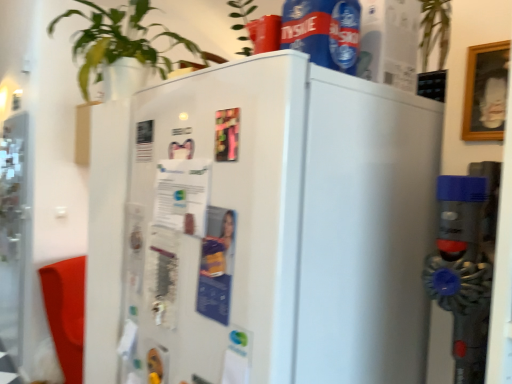
What do you see at coordinates (323, 31) in the screenshot?
I see `blue plastic bottle at upper center` at bounding box center [323, 31].

Locate an element on the screen. The width and height of the screenshot is (512, 384). blue plastic bottle at upper center is located at coordinates (323, 31).

Where is `blue plastic bottle at upper center`? The image size is (512, 384). blue plastic bottle at upper center is located at coordinates 323,31.

Is there a large distance between white glossy refrigerator at center and transparent glass screen door at left?

Yes, white glossy refrigerator at center and transparent glass screen door at left are quite far apart.

Who is smaller, white glossy refrigerator at center or transparent glass screen door at left?

With smaller size is transparent glass screen door at left.

Does white glossy refrigerator at center have a lesser height compared to transparent glass screen door at left?

Correct, white glossy refrigerator at center is not as tall as transparent glass screen door at left.

Which is closer, (317, 366) or (19, 317)?

Point (317, 366) appears to be closer to the viewer than point (19, 317).

Could you tell me if transparent glass screen door at left is turned towards white glossy refrigerator at center?

No, transparent glass screen door at left is not facing towards white glossy refrigerator at center.

In the image, is transparent glass screen door at left on the left side or the right side of white glossy refrigerator at center?

Based on their positions, transparent glass screen door at left is located to the left of white glossy refrigerator at center.

Is transparent glass screen door at left bigger than white glossy refrigerator at center?

Actually, transparent glass screen door at left might be smaller than white glossy refrigerator at center.

Is point (9, 138) behind point (92, 292)?

Yes, it is behind point (92, 292).

You are a GUI agent. You are given a task and a screenshot of the screen. Output one action in this format:
    pyautogui.click(x=<x>, y=<y>)
    Task: Click on the screen door to the left of blue plastic bottle at upper center
    The width and height of the screenshot is (512, 384).
    Given the screenshot: What is the action you would take?
    pyautogui.click(x=13, y=231)

Considering the sizes of transparent glass screen door at left and blue plastic bottle at upper center in the image, is transparent glass screen door at left taller or shorter than blue plastic bottle at upper center?

transparent glass screen door at left is taller than blue plastic bottle at upper center.

Would you say transparent glass screen door at left is to the left or to the right of blue plastic bottle at upper center in the picture?

transparent glass screen door at left is to the left of blue plastic bottle at upper center.

Is green leafy plant at upper left turned away from blue plastic bottle at upper center?

No, blue plastic bottle at upper center is not at the back of green leafy plant at upper left.

From the image's perspective, between green leafy plant at upper left and blue plastic bottle at upper center, which one is located above?

green leafy plant at upper left.

Can you tell me how much green leafy plant at upper left and blue plastic bottle at upper center differ in facing direction?

The facing directions of green leafy plant at upper left and blue plastic bottle at upper center are 180 degrees apart.

Considering the sizes of objects green leafy plant at upper left and white glossy refrigerator at center in the image provided, who is wider, green leafy plant at upper left or white glossy refrigerator at center?

Wider between the two is white glossy refrigerator at center.

Considering the sizes of objects green leafy plant at upper left and white glossy refrigerator at center in the image provided, who is bigger, green leafy plant at upper left or white glossy refrigerator at center?

white glossy refrigerator at center.

Is the position of green leafy plant at upper left less distant than that of white glossy refrigerator at center?

No, green leafy plant at upper left is behind white glossy refrigerator at center.

Locate an element on the screen. This screenshot has height=384, width=512. houseplant behind the white glossy refrigerator at center is located at coordinates (119, 40).

Can you confirm if white glossy refrigerator at center is taller than green leafy plant at upper left?

Correct, white glossy refrigerator at center is much taller as green leafy plant at upper left.

Considering the sizes of white glossy refrigerator at center and green leafy plant at upper left in the image, is white glossy refrigerator at center bigger or smaller than green leafy plant at upper left?

In the image, white glossy refrigerator at center appears to be larger than green leafy plant at upper left.

From the image's perspective, is white glossy refrigerator at center positioned above or below green leafy plant at upper left?

Clearly, from the image's perspective, white glossy refrigerator at center is below green leafy plant at upper left.

You are a GUI agent. You are given a task and a screenshot of the screen. Output one action in this format:
    pyautogui.click(x=<x>, y=<y>)
    Task: Click on the houseplant lying above the white glossy refrigerator at center (from the image's perspective)
    The width and height of the screenshot is (512, 384).
    Given the screenshot: What is the action you would take?
    pyautogui.click(x=119, y=40)

In terms of height, does blue plastic bottle at upper center look taller or shorter compared to green leafy plant at upper left?

Considering their sizes, blue plastic bottle at upper center has less height than green leafy plant at upper left.

Considering their positions, is blue plastic bottle at upper center located in front of or behind green leafy plant at upper left?

In the image, blue plastic bottle at upper center appears in front of green leafy plant at upper left.

I want to click on screen door beneath the white glossy refrigerator at center (from a real-world perspective), so click(13, 231).

You are a GUI agent. You are given a task and a screenshot of the screen. Output one action in this format:
    pyautogui.click(x=<x>, y=<y>)
    Task: Click on the refrigerator that appears above the transparent glass screen door at left (from the image's perspective)
    This screenshot has width=512, height=384.
    Given the screenshot: What is the action you would take?
    pyautogui.click(x=271, y=230)

Considering their positions, is transparent glass screen door at left positioned further to green leafy plant at upper left than white glossy refrigerator at center?

Among the two, transparent glass screen door at left is located further to green leafy plant at upper left.

Looking at the image, which one is located closer to blue plastic bottle at upper center, green leafy plant at upper left or white glossy refrigerator at center?

Among the two, white glossy refrigerator at center is located nearer to blue plastic bottle at upper center.

Estimate the real-world distances between objects in this image. Which object is closer to transparent glass screen door at left, white glossy refrigerator at center or green leafy plant at upper left?

green leafy plant at upper left.

Looking at the image, which one is located closer to green leafy plant at upper left, blue plastic bottle at upper center or transparent glass screen door at left?

blue plastic bottle at upper center is closer to green leafy plant at upper left.

When comparing their distances from green leafy plant at upper left, does transparent glass screen door at left or blue plastic bottle at upper center seem closer?

The object closer to green leafy plant at upper left is blue plastic bottle at upper center.

Estimate the real-world distances between objects in this image. Which object is further from white glossy refrigerator at center, blue plastic bottle at upper center or transparent glass screen door at left?

transparent glass screen door at left lies further to white glossy refrigerator at center than the other object.

Looking at the image, which one is located further to transparent glass screen door at left, green leafy plant at upper left or blue plastic bottle at upper center?

Based on the image, blue plastic bottle at upper center appears to be further to transparent glass screen door at left.

Estimate the real-world distances between objects in this image. Which object is closer to green leafy plant at upper left, white glossy refrigerator at center or blue plastic bottle at upper center?

white glossy refrigerator at center.

Where is `beverage positioned between white glossy refrigerator at center and transparent glass screen door at left from near to far`? beverage positioned between white glossy refrigerator at center and transparent glass screen door at left from near to far is located at coordinates (323, 31).

Where is `houseplant positioned between white glossy refrigerator at center and transparent glass screen door at left from near to far`? The height and width of the screenshot is (384, 512). houseplant positioned between white glossy refrigerator at center and transparent glass screen door at left from near to far is located at coordinates (119, 40).

Image resolution: width=512 pixels, height=384 pixels. In order to click on beverage that lies between green leafy plant at upper left and white glossy refrigerator at center from top to bottom in this screenshot , I will do `click(323, 31)`.

What are the coordinates of `houseplant located between blue plastic bottle at upper center and transparent glass screen door at left in the depth direction` in the screenshot? It's located at (119, 40).